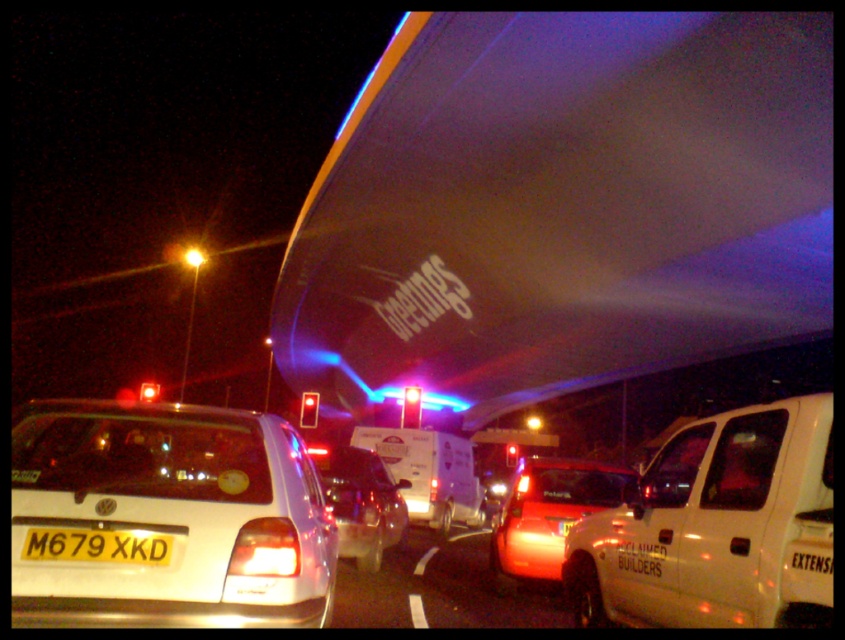
You are a traffic officer assessing the scene. You notice the metallic red car at center and the yellow metallic license plate at center. Which object is bigger in size?

The metallic red car at center is larger in size compared to the yellow metallic license plate at center.